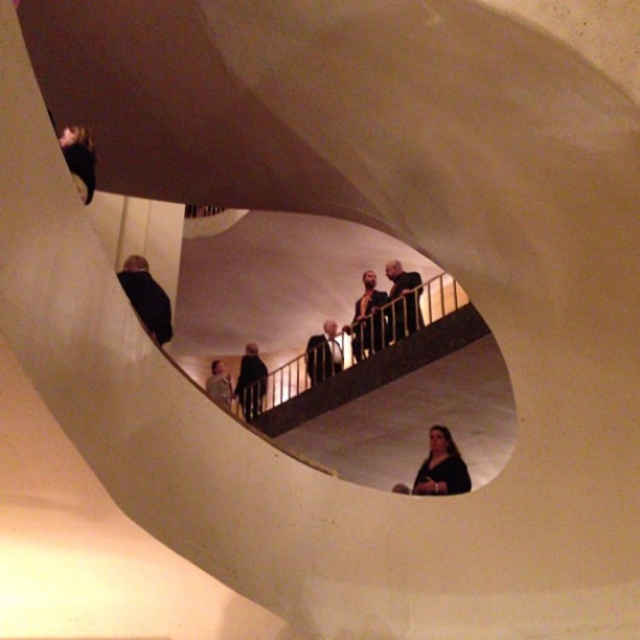
Question: Which of the following is the closest to the observer?

Choices:
 (A) dark gray suit at center
 (B) matte black dress at lower center
 (C) black matte jacket at lower left

Answer: (B)

Question: Estimate the real-world distances between objects in this image. Which object is closer to the black matte jacket at lower left?

Choices:
 (A) black matte jacket at center
 (B) dark gray suit at center
 (C) matte black dress at lower center

Answer: (C)

Question: Is dark brown leather jacket at center to the right of dark gray suit at center from the viewer's perspective?

Choices:
 (A) yes
 (B) no

Answer: (A)

Question: Considering the real-world distances, which object is closest to the light brown leather jacket at center?

Choices:
 (A) dark gray jacket at center
 (B) matte black dress at lower center
 (C) dark brown leather jacket at center

Answer: (A)

Question: Is black matte jacket at lower left wider than light brown leather jacket at center?

Choices:
 (A) no
 (B) yes

Answer: (A)

Question: Does dark gray jacket at center have a lesser width compared to black matte jacket at center?

Choices:
 (A) yes
 (B) no

Answer: (A)